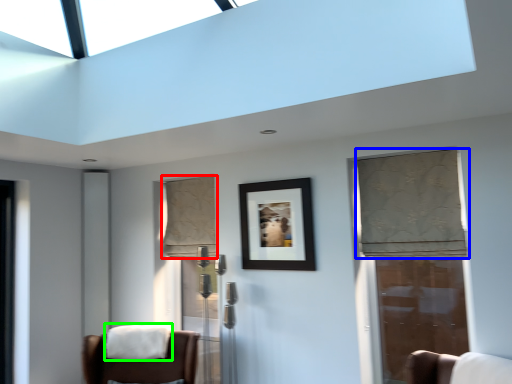
Question: Considering the real-world distances, which object is closest to curtain (highlighted by a red box)? curtain (highlighted by a blue box) or blanket (highlighted by a green box).

Choices:
 (A) curtain
 (B) blanket

Answer: (B)